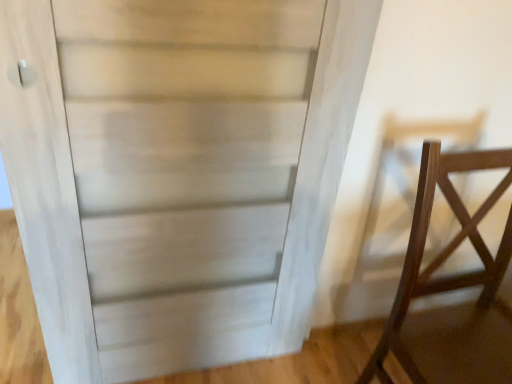
Describe the element at coordinates (444, 248) in the screenshot. I see `dark wood chair at right` at that location.

At what (x,y) coordinates should I click in order to perform the action: click on dark wood chair at right. Please return your answer as a coordinate pair (x, y). The width and height of the screenshot is (512, 384). Looking at the image, I should click on (444, 248).

This screenshot has width=512, height=384. Describe the element at coordinates (176, 172) in the screenshot. I see `white wood door at center` at that location.

Find the location of `white wood door at center`. white wood door at center is located at coordinates (176, 172).

You are a GUI agent. You are given a task and a screenshot of the screen. Output one action in this format:
    pyautogui.click(x=<x>, y=<y>)
    Task: Click on the dark wood chair at right
    Image resolution: width=512 pixels, height=384 pixels.
    Given the screenshot: What is the action you would take?
    pyautogui.click(x=444, y=248)

In the scene shown: Can you confirm if dark wood chair at right is positioned to the right of white wood door at center?

Indeed, dark wood chair at right is positioned on the right side of white wood door at center.

Looking at this image, which object is more forward, dark wood chair at right or white wood door at center?

dark wood chair at right.

Considering the positions of point (421, 158) and point (7, 27), is point (421, 158) closer or farther from the camera than point (7, 27)?

Point (421, 158) appears to be farther away from the viewer than point (7, 27).

From the image's perspective, is dark wood chair at right above or below white wood door at center?

Based on their image positions, dark wood chair at right is located beneath white wood door at center.

From a real-world perspective, does dark wood chair at right stand above white wood door at center?

Actually, dark wood chair at right is physically below white wood door at center in the real world.

Is dark wood chair at right wider than white wood door at center?

Correct, the width of dark wood chair at right exceeds that of white wood door at center.

Considering the sizes of objects dark wood chair at right and white wood door at center in the image provided, who is shorter, dark wood chair at right or white wood door at center?

dark wood chair at right is shorter.

Between dark wood chair at right and white wood door at center, which one has larger size?

With larger size is dark wood chair at right.

Is dark wood chair at right located outside white wood door at center?

Yes.

Is dark wood chair at right positioned far away from white wood door at center?

No, there isn't a large distance between dark wood chair at right and white wood door at center.

Is white wood door at center at the back of dark wood chair at right?

No, dark wood chair at right is not facing away from white wood door at center.

Where is `furniture in front of the white wood door at center`? The image size is (512, 384). furniture in front of the white wood door at center is located at coordinates (444, 248).

Between white wood door at center and dark wood chair at right, which one appears on the right side from the viewer's perspective?

dark wood chair at right.

Who is more distant, white wood door at center or dark wood chair at right?

white wood door at center is behind.

Does point (88, 279) lie behind point (488, 290)?

No, (88, 279) is in front of (488, 290).

From the image's perspective, relative to dark wood chair at right, is white wood door at center above or below?

Clearly, from the image's perspective, white wood door at center is above dark wood chair at right.

From a real-world perspective, which is physically above, white wood door at center or dark wood chair at right?

From a 3D spatial view, white wood door at center is above.

Is white wood door at center wider than dark wood chair at right?

No, white wood door at center is not wider than dark wood chair at right.

Considering the sizes of objects white wood door at center and dark wood chair at right in the image provided, who is shorter, white wood door at center or dark wood chair at right?

Standing shorter between the two is dark wood chair at right.

Considering the sizes of objects white wood door at center and dark wood chair at right in the image provided, who is smaller, white wood door at center or dark wood chair at right?

white wood door at center.

Is white wood door at center spatially inside dark wood chair at right, or outside of it?

white wood door at center cannot be found inside dark wood chair at right.

From the picture: Is white wood door at center far away from dark wood chair at right?

white wood door at center is actually quite close to dark wood chair at right.

From the picture: Is dark wood chair at right at the back of white wood door at center?

white wood door at center is not turned away from dark wood chair at right.

How different are the orientations of white wood door at center and dark wood chair at right in degrees?

white wood door at center and dark wood chair at right are facing 1.88 degrees away from each other.

How far apart are white wood door at center and dark wood chair at right?

20.79 inches.

The image size is (512, 384). I want to click on furniture located in front of the white wood door at center, so (x=444, y=248).

In order to click on door located above the dark wood chair at right (from a real-world perspective) in this screenshot , I will do coord(176,172).

The width and height of the screenshot is (512, 384). Find the location of `door behind the dark wood chair at right`. door behind the dark wood chair at right is located at coordinates pyautogui.click(x=176, y=172).